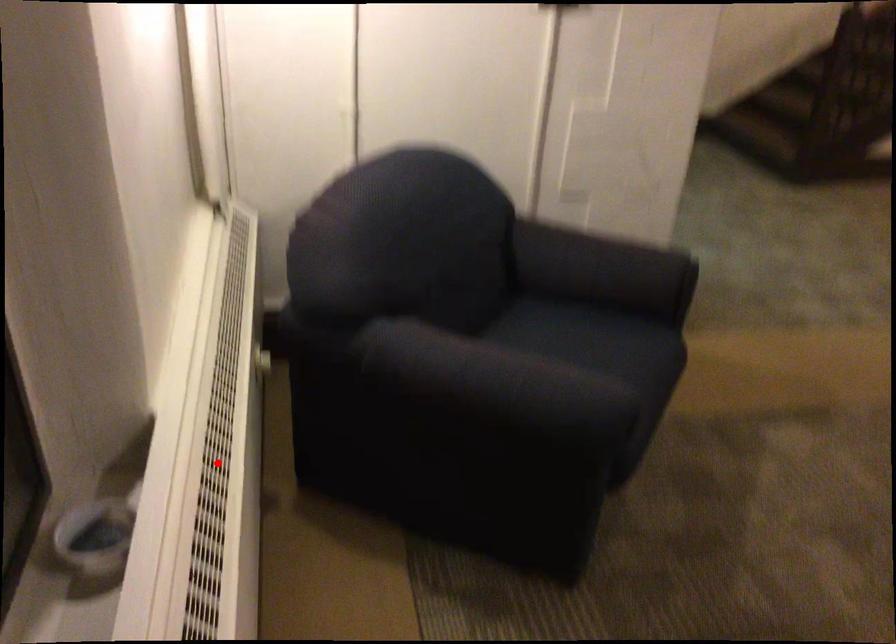
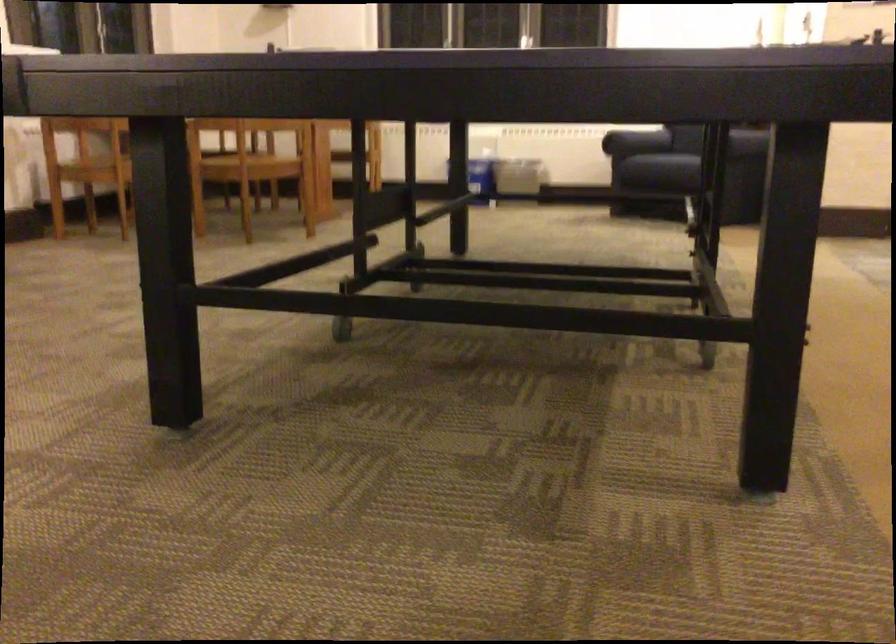
Question: I am providing you with two images of the same scene from different viewpoints. A red point is marked on the first image. Is the red point's position out of view in image 2?

Choices:
 (A) Yes
 (B) No

Answer: (A)